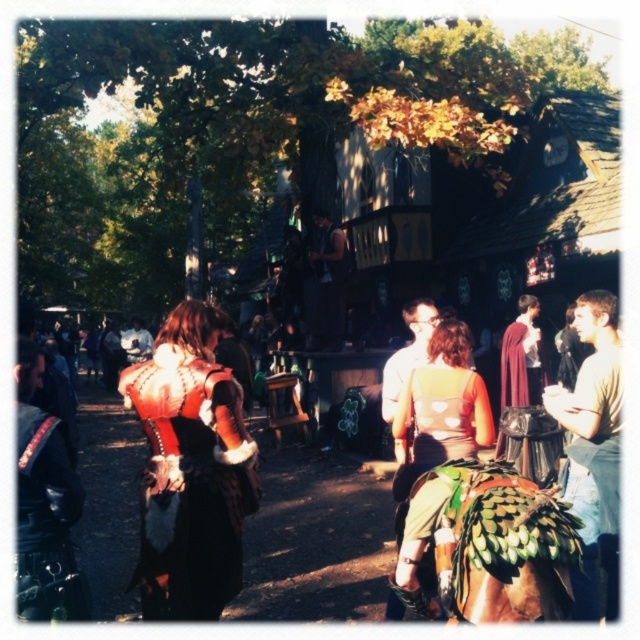
Question: Is leather-like brown vest at center wider than white cotton shirt at right?

Choices:
 (A) yes
 (B) no

Answer: (A)

Question: Is leather-like brown vest at center thinner than leather jacket at left?

Choices:
 (A) yes
 (B) no

Answer: (B)

Question: Based on their relative distances, which object is nearer to the green fabric dress at center?

Choices:
 (A) leather-like brown vest at center
 (B) white cotton shirt at right
 (C) leather jacket at left

Answer: (B)

Question: Does leather-like brown vest at center appear on the left side of white cotton shirt at right?

Choices:
 (A) yes
 (B) no

Answer: (A)

Question: Which point is farther to the camera?

Choices:
 (A) green fabric dress at center
 (B) leather jacket at left
 (C) leather-like brown vest at center

Answer: (C)

Question: Which of the following is the farthest from the observer?

Choices:
 (A) leather jacket at left
 (B) white cotton shirt at right

Answer: (B)